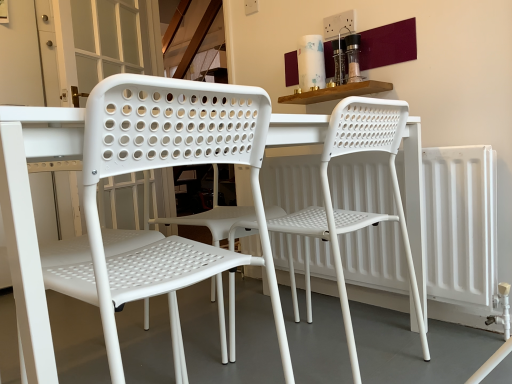
Identify the location of vacant space underneath white matte radiator at right (from a real-world perspective). (426, 321).